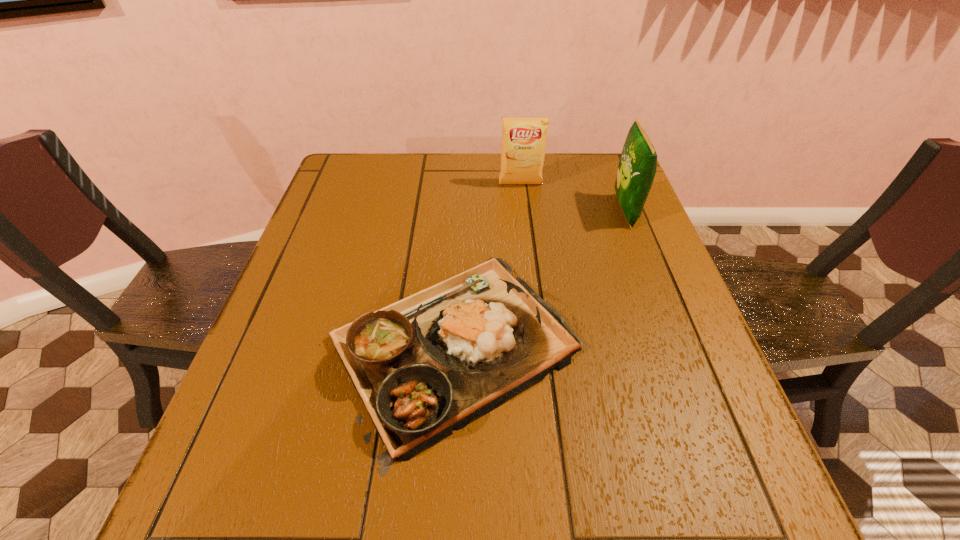
Find the location of a particular element. The image size is (960, 540). vacant point at the far right corner is located at coordinates (603, 155).

In the image, there is a desktop. Find the location of `vacant space at the near right corner`. vacant space at the near right corner is located at coordinates (733, 475).

This screenshot has height=540, width=960. What are the coordinates of `free space between the left crisp (potato chip) and the second farthest object` in the screenshot? It's located at (573, 198).

This screenshot has width=960, height=540. What are the coordinates of `empty space that is in between the farthest object and the right crisp (potato chip)` in the screenshot? It's located at (573, 198).

Where is `vacant area that lies between the nearer crisp (potato chip) and the shortest object`? vacant area that lies between the nearer crisp (potato chip) and the shortest object is located at coordinates (538, 279).

This screenshot has height=540, width=960. I want to click on vacant space that is in between the farthest object and the right crisp (potato chip), so click(573, 198).

The image size is (960, 540). Find the location of `vacant space in between the platter and the right crisp (potato chip)`. vacant space in between the platter and the right crisp (potato chip) is located at coordinates (538, 279).

Image resolution: width=960 pixels, height=540 pixels. Identify the location of vacant area that lies between the rightmost object and the platter. (538, 279).

Image resolution: width=960 pixels, height=540 pixels. Find the location of `vacant area between the rightmost object and the left crisp (potato chip)`. vacant area between the rightmost object and the left crisp (potato chip) is located at coordinates (573, 198).

Point out which object is positioned as the nearest to the nearest object. Please provide its 2D coordinates. Your answer should be formatted as a tuple, i.e. [(x, y)], where the tuple contains the x and y coordinates of a point satisfying the conditions above.

[(637, 167)]